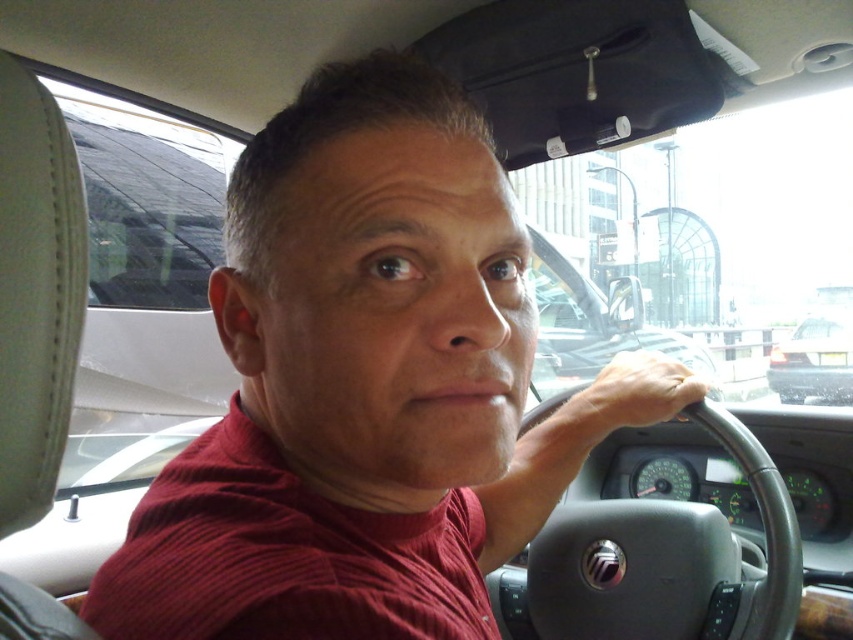
Question: Does smooth skin hand at steering wheel have a greater width compared to matte black sedan at right?

Choices:
 (A) no
 (B) yes

Answer: (A)

Question: Which object is positioned closest to the smooth skin hand at steering wheel?

Choices:
 (A) matte black sedan at right
 (B) black leather steering wheel at center

Answer: (B)

Question: Which is nearer to the black leather steering wheel at center?

Choices:
 (A) smooth skin hand at steering wheel
 (B) matte black sedan at right

Answer: (A)

Question: Can you confirm if black leather steering wheel at center is wider than matte black sedan at right?

Choices:
 (A) no
 (B) yes

Answer: (A)

Question: Where is black leather steering wheel at center located in relation to matte black sedan at right in the image?

Choices:
 (A) right
 (B) left

Answer: (B)

Question: Which object appears farthest from the camera in this image?

Choices:
 (A) matte black sedan at right
 (B) smooth skin hand at steering wheel

Answer: (A)